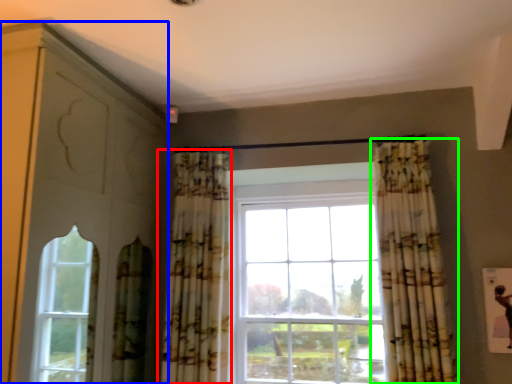
Question: Which object is the farthest from curtain (highlighted by a red box)? Choose among these: dresser (highlighted by a blue box) or curtain (highlighted by a green box).

Choices:
 (A) dresser
 (B) curtain

Answer: (B)